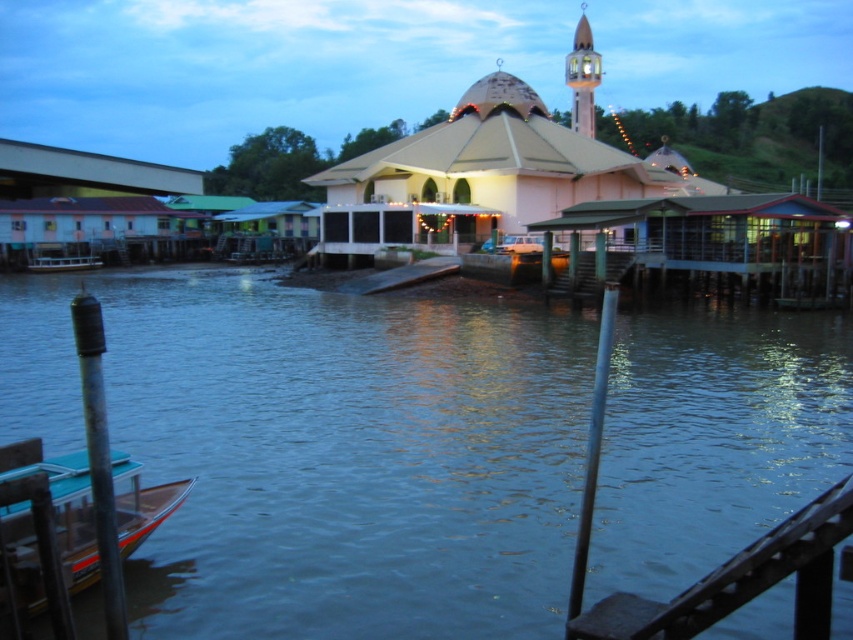
You are standing on the riverside and see the clear water at center and the white plastic boat at lower left. Which object is closer to your right side?

The clear water at center is to the right of white plastic boat at lower left, so the clear water at center is closer to your right side.

You are a photographer setting up equipment on the riverside. You have a camera that can only focus on objects with a width of at least 2 meters. You see the metallic pole at center and the light brown wooden minaret at upper right. Which object should you focus on to ensure the camera can capture it clearly?

The light brown wooden minaret at upper right has a greater width than the metallic pole at center, so focusing on the light brown wooden minaret at upper right would ensure the camera can capture it clearly since it meets the minimum width requirement of 2 meters.

You are standing at the point closest to the viewer in the riverside scene. Which point, point (666,333) or point (42,260), are you standing at?

You are standing at point (666,333) because it is closer to the viewer than point (42,260).